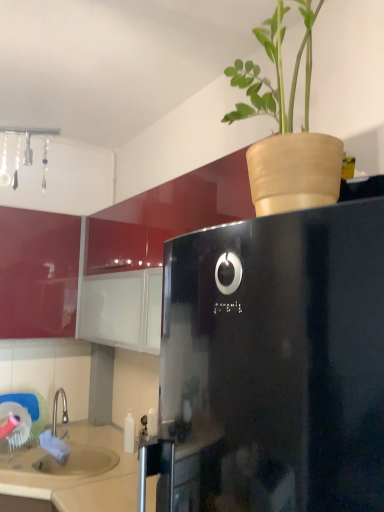
Describe the element at coordinates (38, 273) in the screenshot. The width and height of the screenshot is (384, 512). I see `glossy red cabinet at left` at that location.

Measure the distance between glossy red cabinet at left and camera.

2.25 meters.

What are the coordinates of `glossy red cabinet at left` in the screenshot? It's located at (38, 273).

In order to face beige matte sink at lower left, should I rotate leftwards or rightwards?

You should rotate left by 19.312 degrees.

Image resolution: width=384 pixels, height=512 pixels. I want to click on beige matte sink at lower left, so click(x=75, y=477).

Describe the element at coordinates (75, 477) in the screenshot. I see `beige matte sink at lower left` at that location.

Identify the location of glossy red cabinet at left. (38, 273).

Which is more to the right, glossy red cabinet at left or beige matte sink at lower left?

From the viewer's perspective, beige matte sink at lower left appears more on the right side.

Which object is closer to the camera, glossy red cabinet at left or beige matte sink at lower left?

beige matte sink at lower left.

Which is behind, point (4, 250) or point (126, 507)?

Point (4, 250)

From the image's perspective, is glossy red cabinet at left above or below beige matte sink at lower left?

Based on their image positions, glossy red cabinet at left is located above beige matte sink at lower left.

Consider the image. From a real-world perspective, relative to beige matte sink at lower left, is glossy red cabinet at left vertically above or below?

Clearly, from a real-world perspective, glossy red cabinet at left is above beige matte sink at lower left.

Considering the relative sizes of glossy red cabinet at left and beige matte sink at lower left in the image provided, is glossy red cabinet at left wider than beige matte sink at lower left?

No.

Is glossy red cabinet at left taller or shorter than beige matte sink at lower left?

Clearly, glossy red cabinet at left is taller compared to beige matte sink at lower left.

Is glossy red cabinet at left bigger or smaller than beige matte sink at lower left?

glossy red cabinet at left is bigger than beige matte sink at lower left.

Is glossy red cabinet at left situated inside beige matte sink at lower left or outside?

glossy red cabinet at left is not inside beige matte sink at lower left, it's outside.

Are glossy red cabinet at left and beige matte sink at lower left beside each other?

They are not placed beside each other.

Is glossy red cabinet at left aimed at beige matte sink at lower left?

No, glossy red cabinet at left is not facing towards beige matte sink at lower left.

Image resolution: width=384 pixels, height=512 pixels. I want to click on cabinetry above the beige matte sink at lower left (from the image's perspective), so click(38, 273).

Which object is positioned more to the right, beige matte sink at lower left or glossy red cabinet at left?

beige matte sink at lower left is more to the right.

Relative to glossy red cabinet at left, is beige matte sink at lower left in front or behind?

Clearly, beige matte sink at lower left is in front of glossy red cabinet at left.

Considering the points (50, 501) and (66, 253), which point is in front, point (50, 501) or point (66, 253)?

The point (50, 501) is closer.

From the image's perspective, is beige matte sink at lower left located above glossy red cabinet at left?

No, from the image's perspective, beige matte sink at lower left is not above glossy red cabinet at left.

From a real-world perspective, is beige matte sink at lower left above or below glossy red cabinet at left?

beige matte sink at lower left is below glossy red cabinet at left.

Does beige matte sink at lower left have a lesser width compared to glossy red cabinet at left?

No.

Between beige matte sink at lower left and glossy red cabinet at left, which one has less height?

Standing shorter between the two is beige matte sink at lower left.

Based on their sizes in the image, would you say beige matte sink at lower left is bigger or smaller than glossy red cabinet at left?

Considering their sizes, beige matte sink at lower left takes up less space than glossy red cabinet at left.

Choose the correct answer: Is beige matte sink at lower left inside glossy red cabinet at left or outside it?

The correct answer is: outside.

Consider the image. Are beige matte sink at lower left and glossy red cabinet at left far apart?

They are positioned close to each other.

Does beige matte sink at lower left turn towards glossy red cabinet at left?

No, beige matte sink at lower left is not oriented towards glossy red cabinet at left.

Can you tell me how much beige matte sink at lower left and glossy red cabinet at left differ in facing direction?

The angular difference between beige matte sink at lower left and glossy red cabinet at left is 52.4 degrees.

How far apart are beige matte sink at lower left and glossy red cabinet at left?

beige matte sink at lower left and glossy red cabinet at left are 33.95 inches apart from each other.

Identify the location of counter top that appears below the glossy red cabinet at left (from a real-world perspective). The height and width of the screenshot is (512, 384). (75, 477).

In order to click on counter top in front of the glossy red cabinet at left in this screenshot , I will do `click(75, 477)`.

I want to click on counter top on the right of glossy red cabinet at left, so click(x=75, y=477).